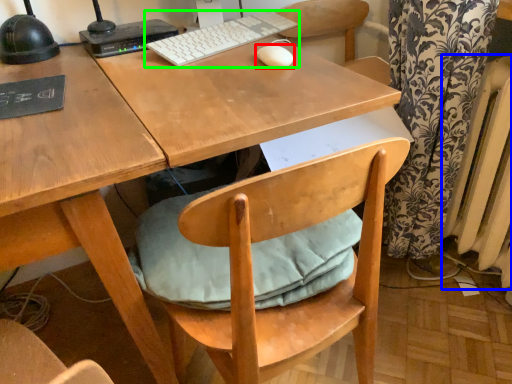
Question: Based on their relative distances, which object is farther from mouse (highlighted by a red box)? Choose from radiator (highlighted by a blue box) and computer keyboard (highlighted by a green box).

Choices:
 (A) radiator
 (B) computer keyboard

Answer: (A)